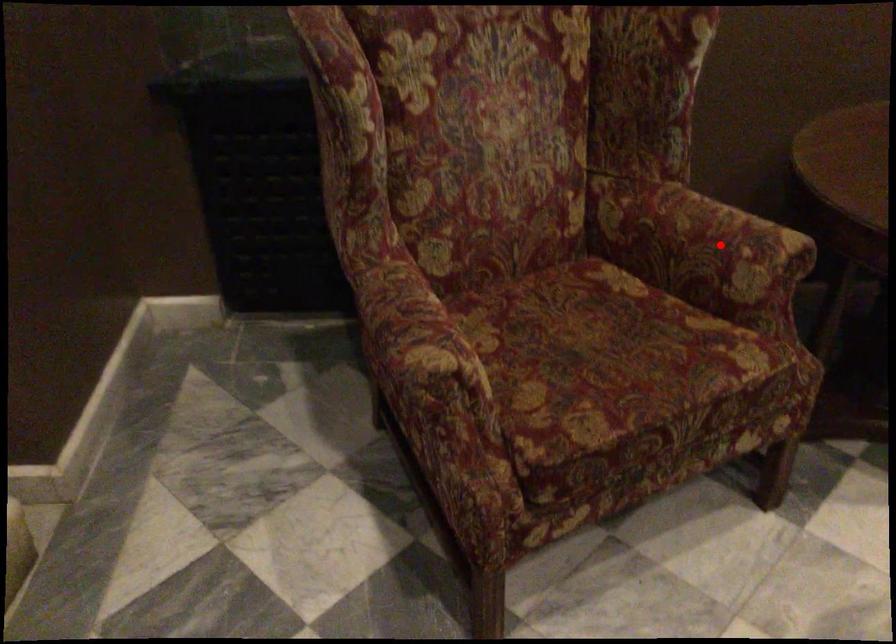
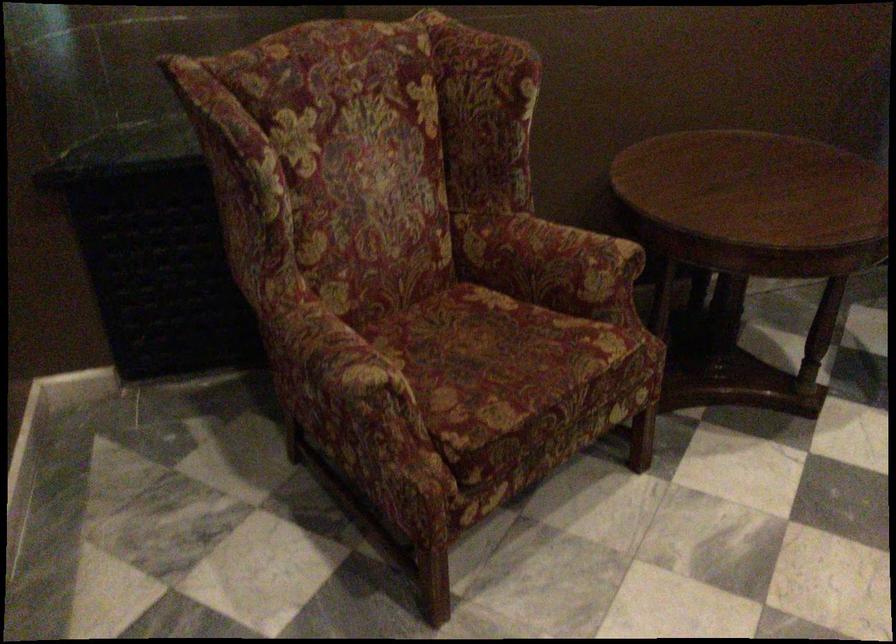
In the second image, find the point that corresponds to the highlighted location in the first image.

(572, 256)